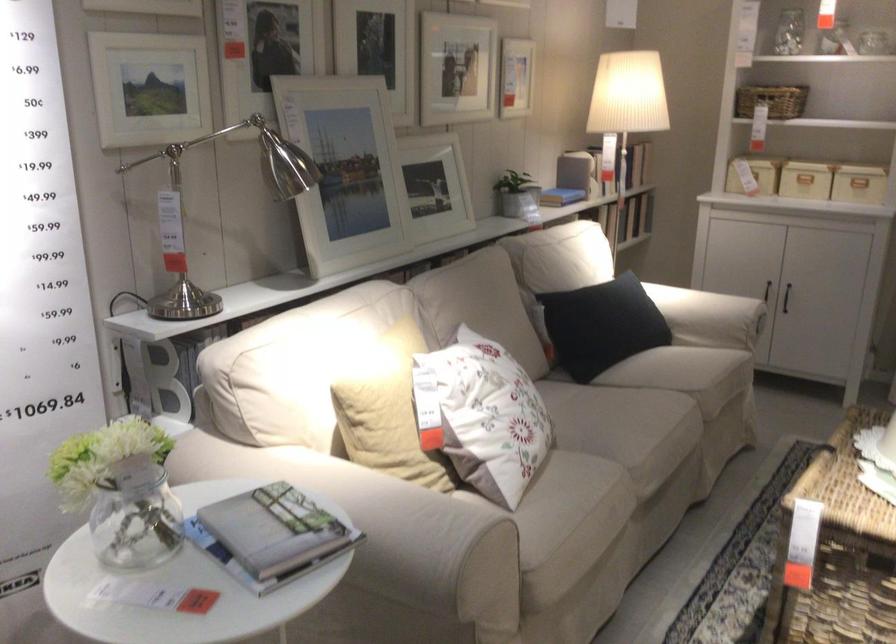
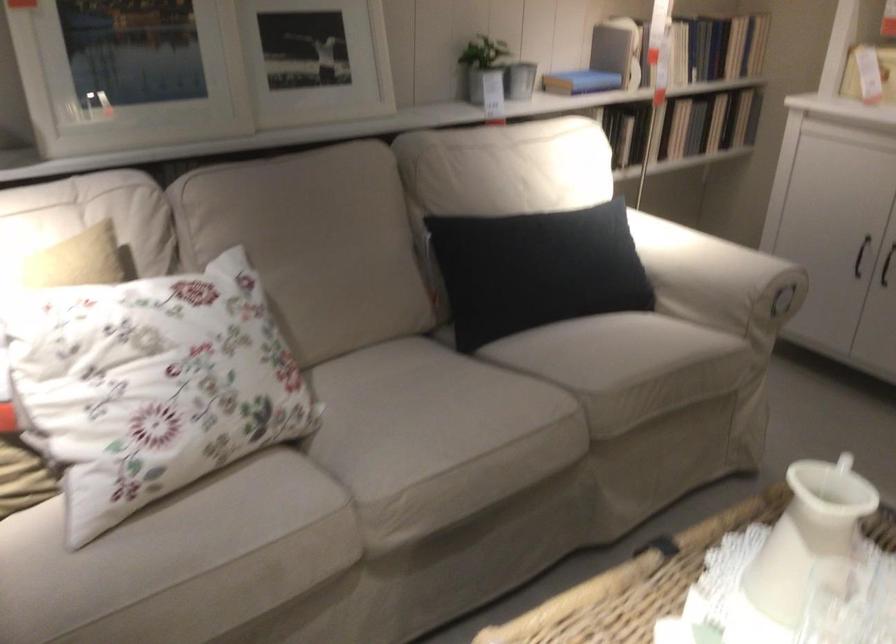
Where in the second image is the point corresponding to (793,289) from the first image?

(886, 265)